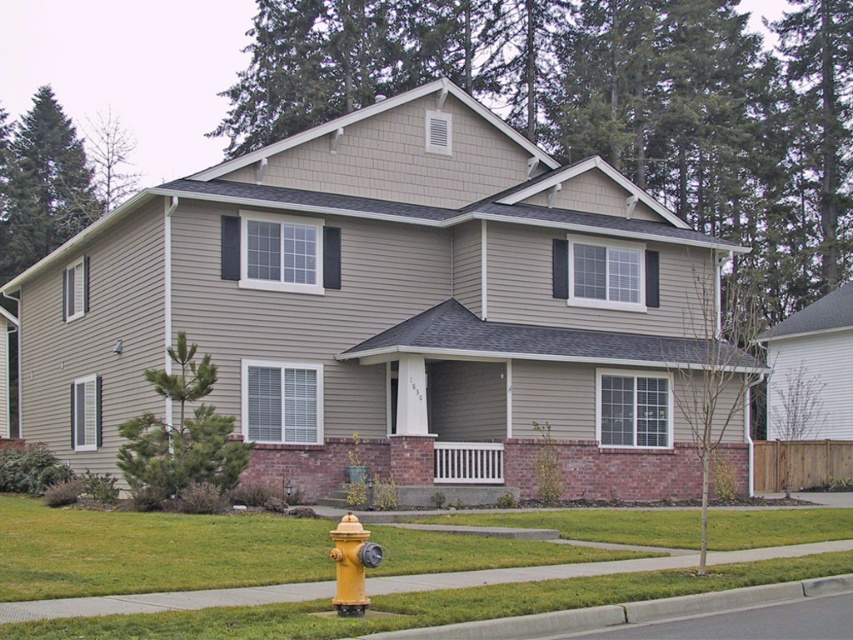
Does green leafy tree at upper center have a greater width compared to green leafy tree at center?

Indeed, green leafy tree at upper center has a greater width compared to green leafy tree at center.

Is green leafy tree at upper center to the right of green leafy tree at center from the viewer's perspective?

No, green leafy tree at upper center is not to the right of green leafy tree at center.

Locate an element on the screen. This screenshot has width=853, height=640. green leafy tree at upper center is located at coordinates (605, 102).

Which of these two, green leafy tree at upper center or yellow matte hydrant at lower center, stands taller?

Standing taller between the two is green leafy tree at upper center.

Between point (252, 68) and point (350, 579), which one is positioned behind?

Positioned behind is point (252, 68).

Image resolution: width=853 pixels, height=640 pixels. In order to click on green leafy tree at upper center in this screenshot , I will do `click(605, 102)`.

Is green leafy tree at upper center smaller than green leafy tree at upper left?

No.

Does green leafy tree at upper center appear on the right side of green leafy tree at upper left?

Correct, you'll find green leafy tree at upper center to the right of green leafy tree at upper left.

Find the location of `green leafy tree at upper center`. green leafy tree at upper center is located at coordinates (605, 102).